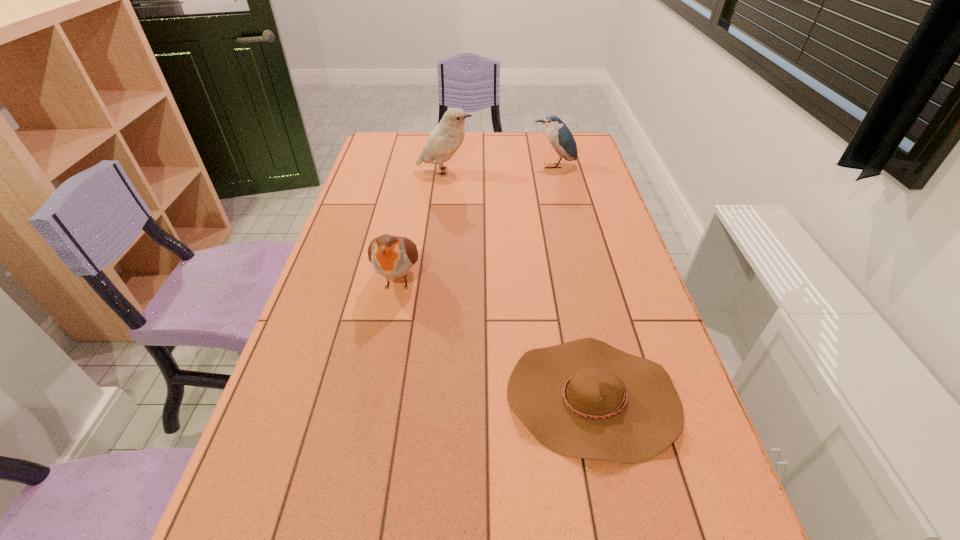
The image size is (960, 540). What are the coordinates of `bird object that ranks as the second closest to the tallest object` in the screenshot? It's located at (391, 256).

The width and height of the screenshot is (960, 540). In order to click on vacant area that satisfies the following two spatial constraints: 1. at the tip of the rightmost bird's beak; 2. at the beak of the tallest bird in this screenshot , I will do (x=555, y=172).

Locate an element on the screen. This screenshot has width=960, height=540. vacant space that satisfies the following two spatial constraints: 1. at the face of the third farthest object; 2. on the left side of the nearest object is located at coordinates (374, 398).

Find the location of `free region that satisfies the following two spatial constraints: 1. at the face of the nearest bird; 2. on the right side of the cowboy hat`. free region that satisfies the following two spatial constraints: 1. at the face of the nearest bird; 2. on the right side of the cowboy hat is located at coordinates (374, 398).

The image size is (960, 540). What are the coordinates of `free region that satisfies the following two spatial constraints: 1. at the beak of the tallest bird; 2. at the face of the third farthest object` in the screenshot? It's located at (432, 279).

What are the coordinates of `free region that satisfies the following two spatial constraints: 1. at the beak of the tallest bird; 2. on the back side of the shortest object` in the screenshot? It's located at (419, 398).

Image resolution: width=960 pixels, height=540 pixels. I want to click on vacant region that satisfies the following two spatial constraints: 1. at the beak of the tallest bird; 2. on the right side of the cowboy hat, so click(x=419, y=398).

Identify the location of vacant space that satisfies the following two spatial constraints: 1. at the beak of the tallest object; 2. on the left side of the cowboy hat. This screenshot has height=540, width=960. (419, 398).

Find the location of a particular element. This screenshot has height=540, width=960. vacant space that satisfies the following two spatial constraints: 1. at the beak of the tallest bird; 2. on the back side of the shortest object is located at coordinates (419, 398).

You are a GUI agent. You are given a task and a screenshot of the screen. Output one action in this format:
    pyautogui.click(x=<x>, y=<y>)
    Task: Click on the vacant region that satisfies the following two spatial constraints: 1. at the beak of the tallest object; 2. at the face of the nearest bird
    This screenshot has width=960, height=540.
    Given the screenshot: What is the action you would take?
    pyautogui.click(x=432, y=279)